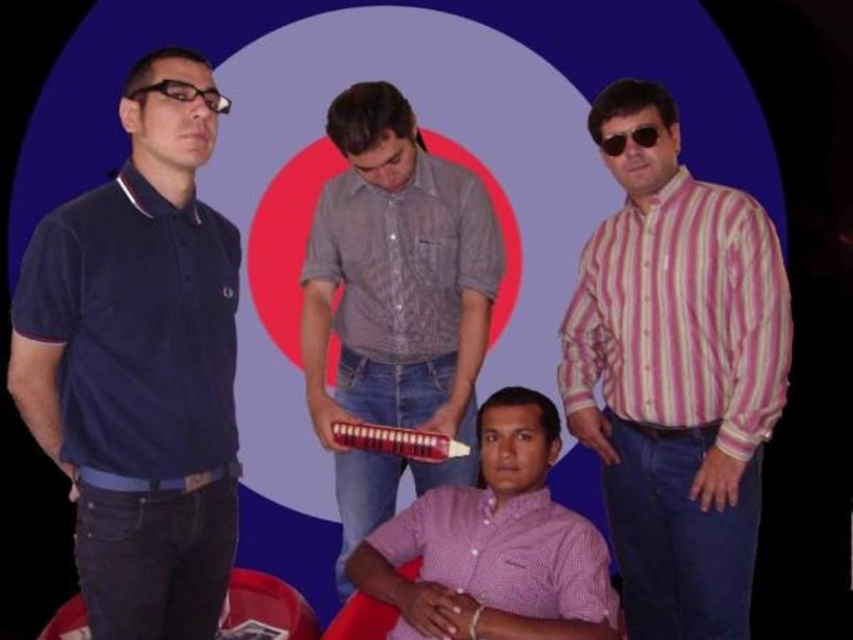
From the picture: You are standing in front of the image and want to hand a gift to the navy blue polo shirt at left and the black plastic glasses at left. Which one can you reach without moving closer?

The navy blue polo shirt at left is closer to the viewer than the black plastic glasses at left, so you can reach the navy blue polo shirt at left without moving closer.